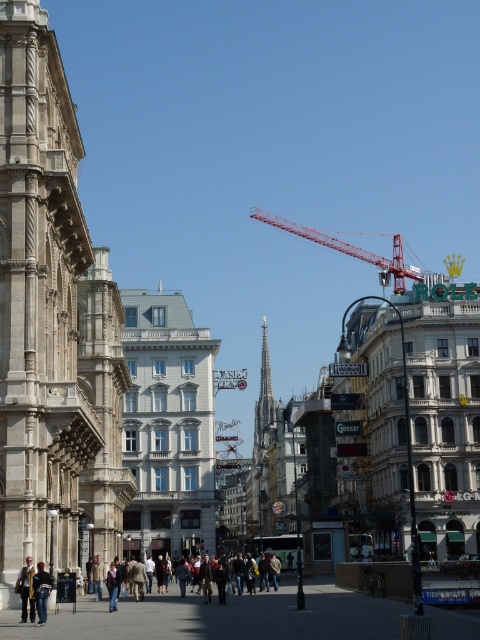
Can you confirm if light brown leather jacket at lower left is thinner than brown leather jacket at center?

Yes, light brown leather jacket at lower left is thinner than brown leather jacket at center.

Is point (33, 608) less distant than point (126, 598)?

Yes, point (33, 608) is in front of point (126, 598).

Locate an element on the screen. This screenshot has width=480, height=640. light brown leather jacket at lower left is located at coordinates (25, 589).

This screenshot has height=640, width=480. What do you see at coordinates (41, 592) in the screenshot? I see `dark gray jacket at lower left` at bounding box center [41, 592].

Is dark gray jacket at lower left wider than brown leather jacket at center?

No, dark gray jacket at lower left is not wider than brown leather jacket at center.

This screenshot has width=480, height=640. What do you see at coordinates (41, 592) in the screenshot?
I see `dark gray jacket at lower left` at bounding box center [41, 592].

This screenshot has height=640, width=480. I want to click on dark gray jacket at lower left, so click(41, 592).

Can you confirm if white stone tower at left is positioned to the left of dark gray jacket at lower left?

Correct, you'll find white stone tower at left to the left of dark gray jacket at lower left.

What do you see at coordinates (51, 323) in the screenshot?
I see `white stone tower at left` at bounding box center [51, 323].

At what (x,y) coordinates should I click in order to perform the action: click on white stone tower at left. Please return your answer as a coordinate pair (x, y). The image size is (480, 640). Looking at the image, I should click on coord(51,323).

Identify the location of white stone tower at left. (x=51, y=323).